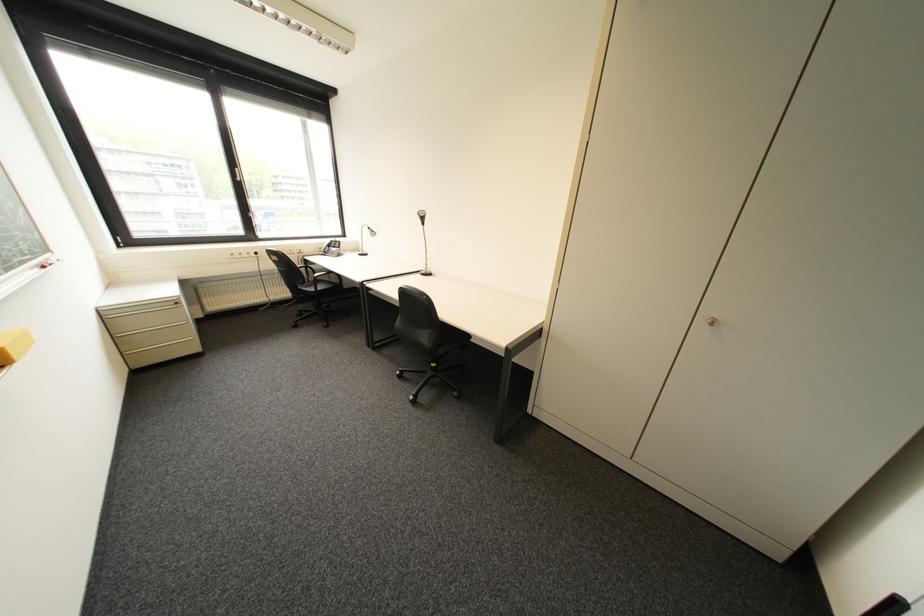
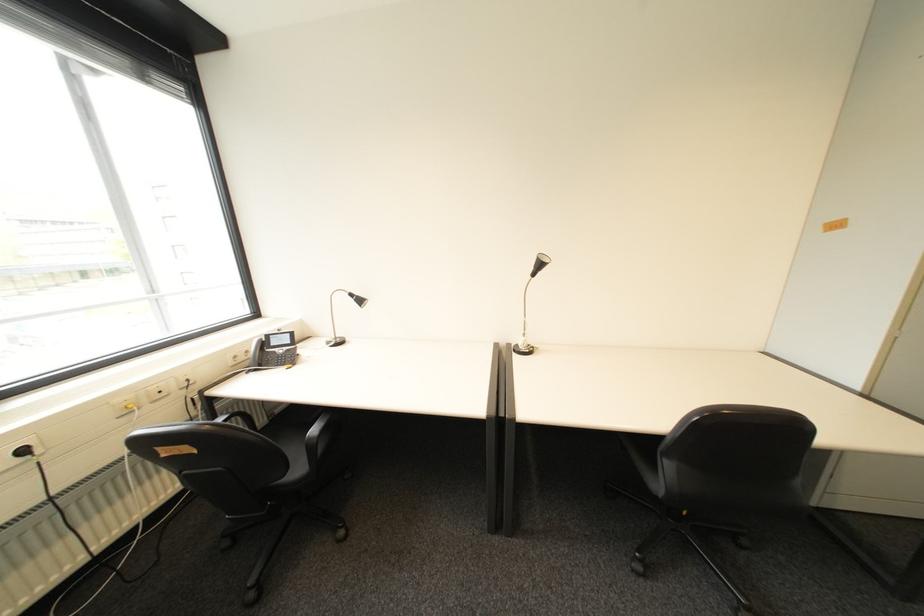
Find the pixel in the second image that matches (266,254) in the first image.

(34, 452)